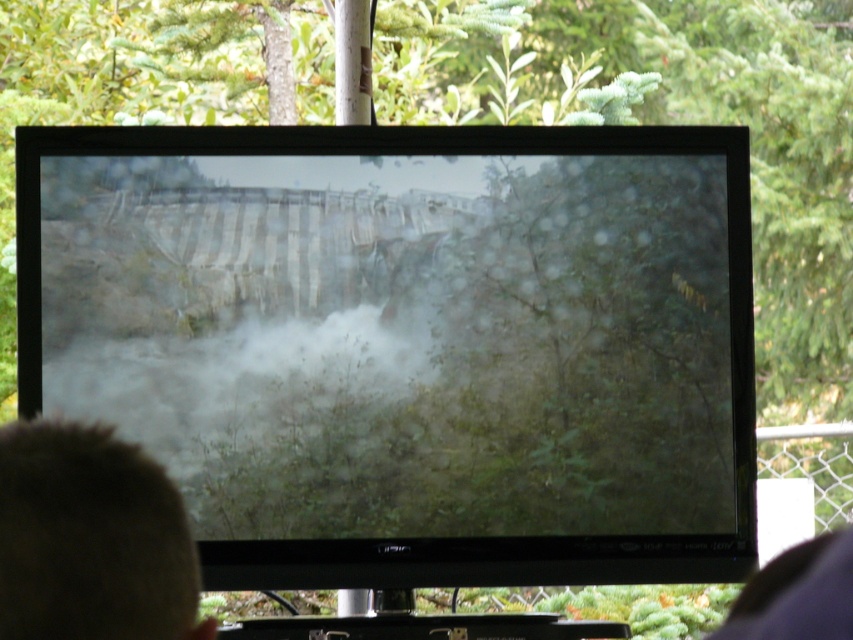
You are trying to determine the relative sizes of objects in the scene. Given that the matte black monitor at center and the brown fuzzy hair at lower left are both visible, which object is wider?

The matte black monitor at center is wider than the brown fuzzy hair at lower left.

You are a delivery robot with a package that is 4 feet wide. You need to deliver it to the person watching the TV. The path to them is clear except for the space between the matte black monitor at center and the brown fuzzy hair at lower left. Can your package fit through that space?

The distance between the matte black monitor at center and the brown fuzzy hair at lower left is 3.88 feet. Since the package is 4 feet wide, it cannot fit through the space as it is slightly wider than the available gap.

You are a photographer trying to capture a clear shot of the brown fuzzy hair at lower left without the matte black monitor at center blocking it. What adjustment should you make to your camera angle?

The matte black monitor at center is positioned over brown fuzzy hair at lower left, so you should lower your camera angle to avoid the monitor blocking the view of the brown fuzzy hair at lower left.